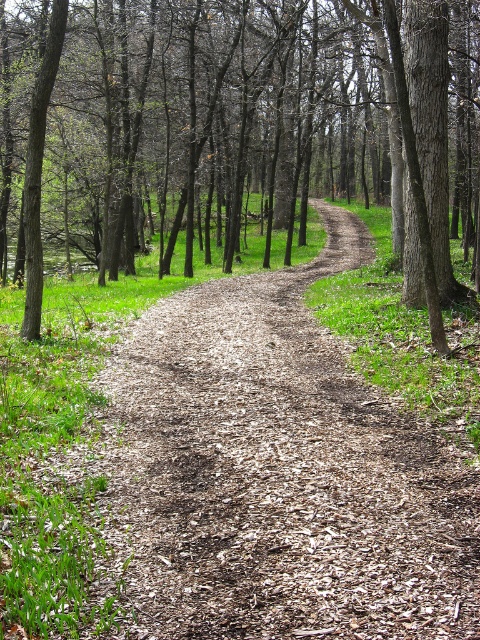
You are standing at the starting point of the dirt path in the forest scene. You see two points marked on the path ahead of you. One is at point coordinates point (445, 604) and the other is at point coordinates point (337, 81). Which point is closer to you?

Point (445, 604) is closer to the camera than point (337, 81), so the point at coordinates point (445, 604) is closer to you.

You are a hiker trying to follow the brown mulch dirt track at center through the forest. There is a large brown bark tree at center blocking your path. Can you pass around the tree without leaving the track?

The brown mulch dirt track at center is smaller than the brown bark tree at center, so the track may be too narrow to go around the tree without leaving it. You might need to find an alternative route or navigate carefully.

You are standing at the starting point of the dirt path in the forest scene. There is a point marked at coordinates (277, 474). Can you determine if this point is located on the dirt path?

The brown mulch dirt track at center is represented by point (277, 474), so yes, the point is located on the dirt path.